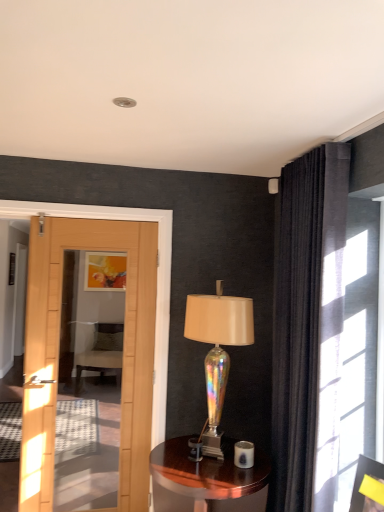
Question: Is the position of iridescent glass lamp at center less distant than that of shiny brown wood side table at center?

Choices:
 (A) yes
 (B) no

Answer: (B)

Question: Is iridescent glass lamp at center oriented towards shiny brown wood side table at center?

Choices:
 (A) no
 (B) yes

Answer: (A)

Question: Is iridescent glass lamp at center not inside shiny brown wood side table at center?

Choices:
 (A) no
 (B) yes

Answer: (B)

Question: From a real-world perspective, is iridescent glass lamp at center located higher than shiny brown wood side table at center?

Choices:
 (A) yes
 (B) no

Answer: (A)

Question: Considering the relative sizes of iridescent glass lamp at center and shiny brown wood side table at center in the image provided, is iridescent glass lamp at center smaller than shiny brown wood side table at center?

Choices:
 (A) yes
 (B) no

Answer: (A)

Question: Can you confirm if iridescent glass lamp at center is taller than shiny brown wood side table at center?

Choices:
 (A) no
 (B) yes

Answer: (B)

Question: Considering the relative sizes of shiny brown wood side table at center and dark velvet curtain at upper right in the image provided, is shiny brown wood side table at center wider than dark velvet curtain at upper right?

Choices:
 (A) yes
 (B) no

Answer: (A)

Question: From a real-world perspective, is shiny brown wood side table at center below dark velvet curtain at upper right?

Choices:
 (A) yes
 (B) no

Answer: (A)

Question: Does shiny brown wood side table at center have a lesser width compared to dark velvet curtain at upper right?

Choices:
 (A) no
 (B) yes

Answer: (A)

Question: Is shiny brown wood side table at center directly adjacent to dark velvet curtain at upper right?

Choices:
 (A) no
 (B) yes

Answer: (A)

Question: Is shiny brown wood side table at center positioned before dark velvet curtain at upper right?

Choices:
 (A) yes
 (B) no

Answer: (B)

Question: Is shiny brown wood side table at center to the left of dark velvet curtain at upper right from the viewer's perspective?

Choices:
 (A) yes
 (B) no

Answer: (A)

Question: Can you confirm if dark velvet curtain at upper right is taller than yellow paper at upper right, the second picture frame from the top?

Choices:
 (A) yes
 (B) no

Answer: (A)